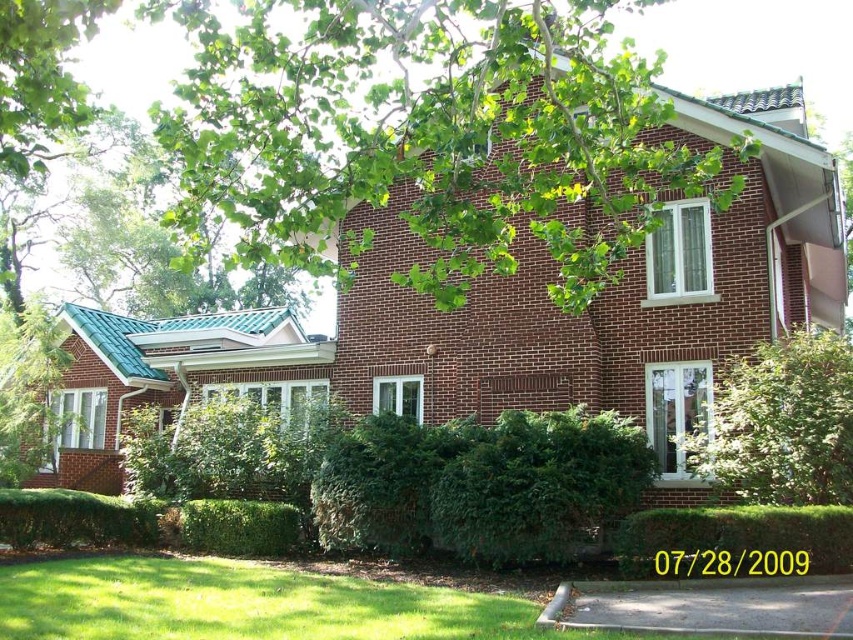
You are a gardener planning to trim the green leafy tree at upper center and the green leafy bush at center. Which of the two plants requires a ladder to reach its branches?

The green leafy tree at upper center requires a ladder to reach its branches because it is bigger than the green leafy bush at center.

You are standing in the front yard of the two story brick house and want to walk from the green leafy bush at lower center to the green leafy hedge at center. Which direction should you move to get closer to the hedge?

You should move backward because the green leafy bush at lower center is closer to you than the green leafy hedge at center, so moving backward will take you towards the hedge.

Based on the photo, you are standing at the point marked as point (x=425, y=132). What object is located exactly at that point?

The green leafy tree at upper center is located exactly at point (x=425, y=132).